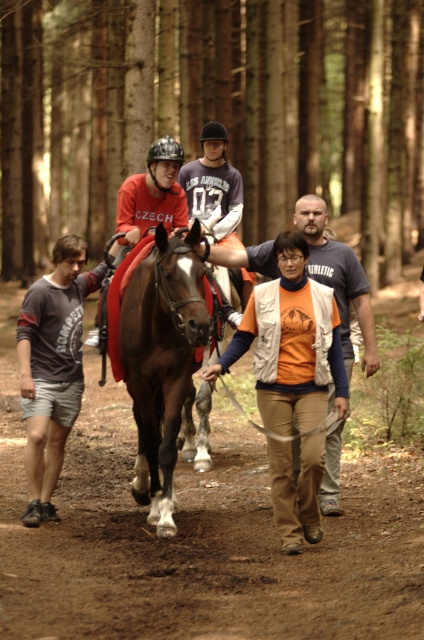
Question: Which of the following is the closest to the observer?

Choices:
 (A) (265, 140)
 (B) (359, 310)
 (C) (130, 288)
 (D) (234, 212)

Answer: (C)

Question: Which point appears closest to the camera in this image?

Choices:
 (A) (170, 486)
 (B) (309, 241)
 (C) (204, 124)
 (D) (25, 355)

Answer: (D)

Question: Which object appears farthest from the camera in this image?

Choices:
 (A) brown dirt track at center
 (B) matte red saddle at center

Answer: (B)

Question: Is brown glossy horse at center bigger than gray cotton t-shirt at lower left?

Choices:
 (A) yes
 (B) no

Answer: (A)

Question: Is matte gray jersey at center closer to the viewer compared to matte red saddle at center?

Choices:
 (A) no
 (B) yes

Answer: (A)

Question: Does gray cotton t-shirt at lower left have a larger size compared to orange cotton t-shirt at center?

Choices:
 (A) no
 (B) yes

Answer: (B)